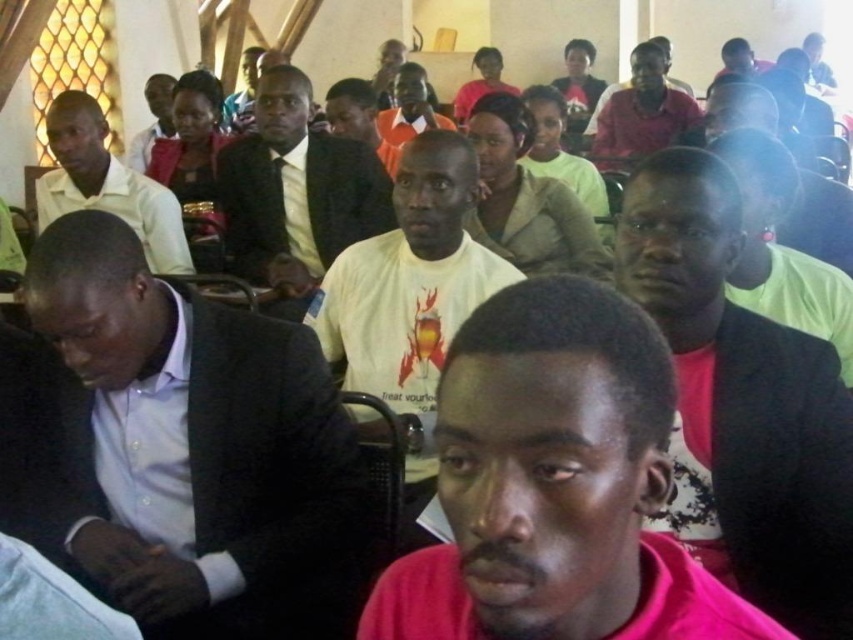
Can you confirm if pink fabric shirt at center is positioned below white t-shirt at center?

Correct, pink fabric shirt at center is located below white t-shirt at center.

Is point (740, 442) in front of point (440, 216)?

Yes, it is.

Find the location of a particular element. This screenshot has height=640, width=853. pink fabric shirt at center is located at coordinates (746, 396).

Does pink fabric shirt at center appear over matte black suit at center?

No.

Is point (804, 634) behind point (242, 273)?

No, it is in front of (242, 273).

Does point (828, 554) come closer to viewer compared to point (260, 269)?

Yes, point (828, 554) is in front of point (260, 269).

Locate an element on the screen. The width and height of the screenshot is (853, 640). pink fabric shirt at center is located at coordinates (746, 396).

Measure the distance from white t-shirt at center to matte black shirt at upper left.

The distance of white t-shirt at center from matte black shirt at upper left is 2.13 meters.

Is point (360, 275) closer to viewer compared to point (177, 260)?

Yes, point (360, 275) is closer to viewer.

You are a GUI agent. You are given a task and a screenshot of the screen. Output one action in this format:
    pyautogui.click(x=<x>, y=<y>)
    Task: Click on the white t-shirt at center
    Image resolution: width=853 pixels, height=640 pixels.
    Given the screenshot: What is the action you would take?
    pyautogui.click(x=410, y=291)